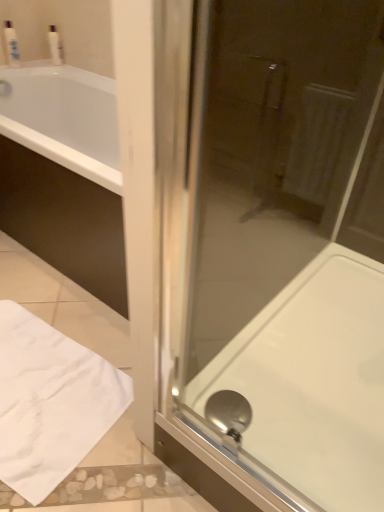
The image size is (384, 512). In order to click on free space to the left of white glossy bottle at upper left, the 2th toiletry positioned from the left in this screenshot , I will do `click(31, 65)`.